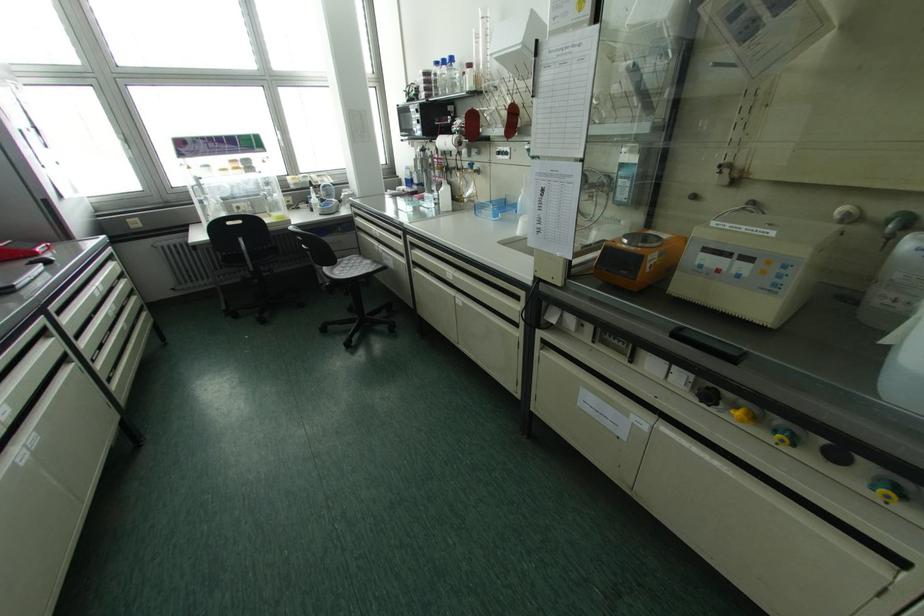
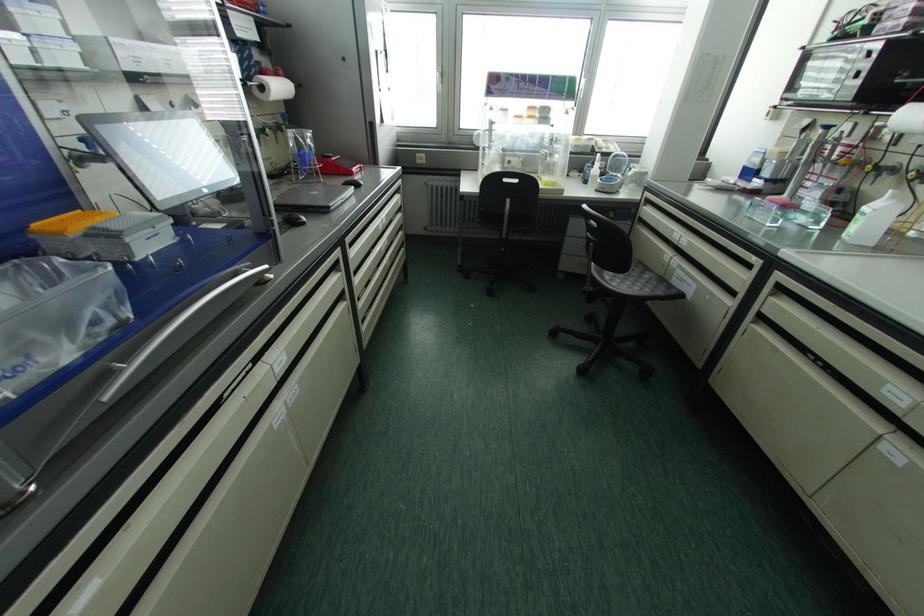
Question: The first image is from the beginning of the video and the second image is from the end. How did the camera likely rotate when shooting the video?

Choices:
 (A) Left
 (B) Right
 (C) Up
 (D) Down

Answer: (A)